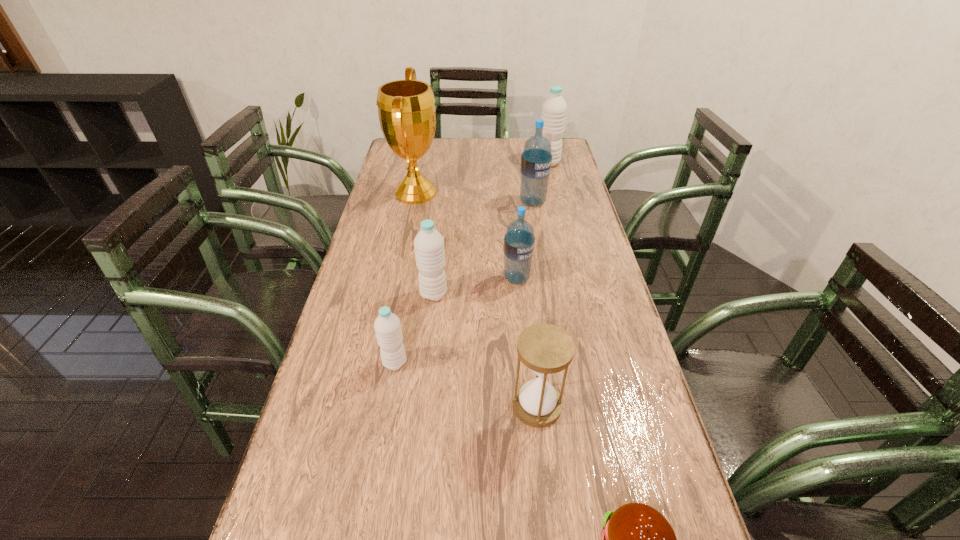
This screenshot has height=540, width=960. In order to click on the tallest object in this screenshot , I will do `click(406, 109)`.

Find the location of a particular element. The height and width of the screenshot is (540, 960). award is located at coordinates (406, 109).

At what (x,y) coordinates should I click in order to perform the action: click on the biggest white water bottle. Please return your answer as a coordinate pair (x, y). Image resolution: width=960 pixels, height=540 pixels. Looking at the image, I should click on (554, 109).

The width and height of the screenshot is (960, 540). What are the coordinates of `the farthest water bottle` in the screenshot? It's located at (554, 109).

Where is `the farther blue water bottle`? The width and height of the screenshot is (960, 540). the farther blue water bottle is located at coordinates (536, 159).

Identify the location of the second farthest water bottle. Image resolution: width=960 pixels, height=540 pixels. (536, 159).

Identify the location of the nearer blue water bottle. This screenshot has height=540, width=960. (519, 240).

Where is `the second water bottle from left to right`? the second water bottle from left to right is located at coordinates (429, 249).

Find the location of a particular element. the second smallest white water bottle is located at coordinates (429, 249).

Where is `white hourglass`? The image size is (960, 540). white hourglass is located at coordinates (546, 349).